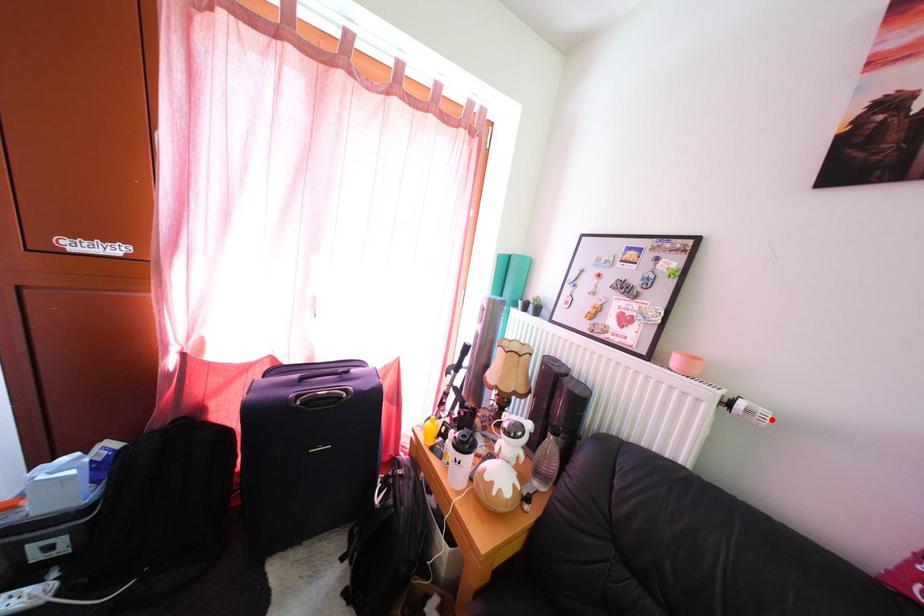
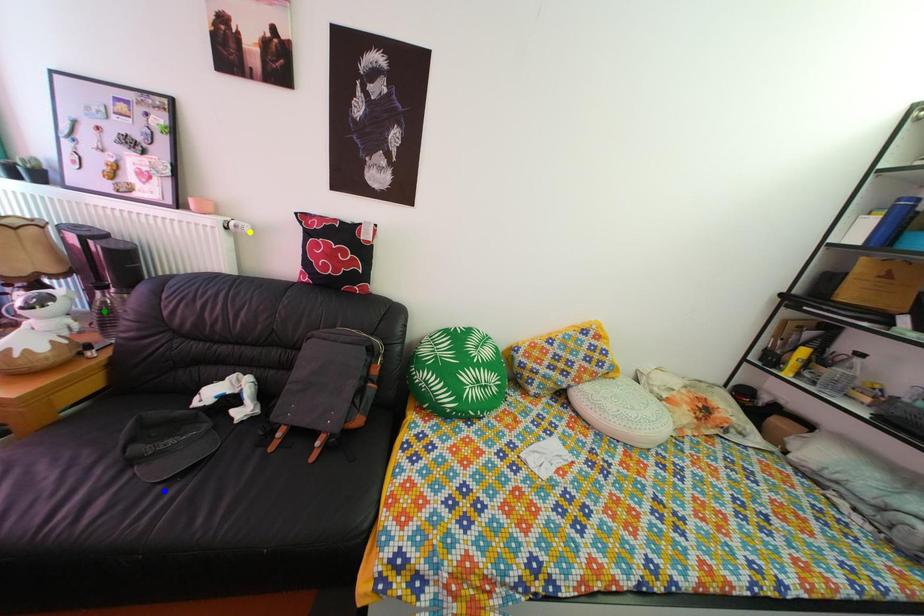
Question: I am providing you with two images of the same scene from different viewpoints. A red point is marked on the first image. You are given multiple points on the second image. Can you choose the point in image 2 that corresponds to the point in image 1?

Choices:
 (A) yellow point
 (B) green point
 (C) blue point

Answer: (A)